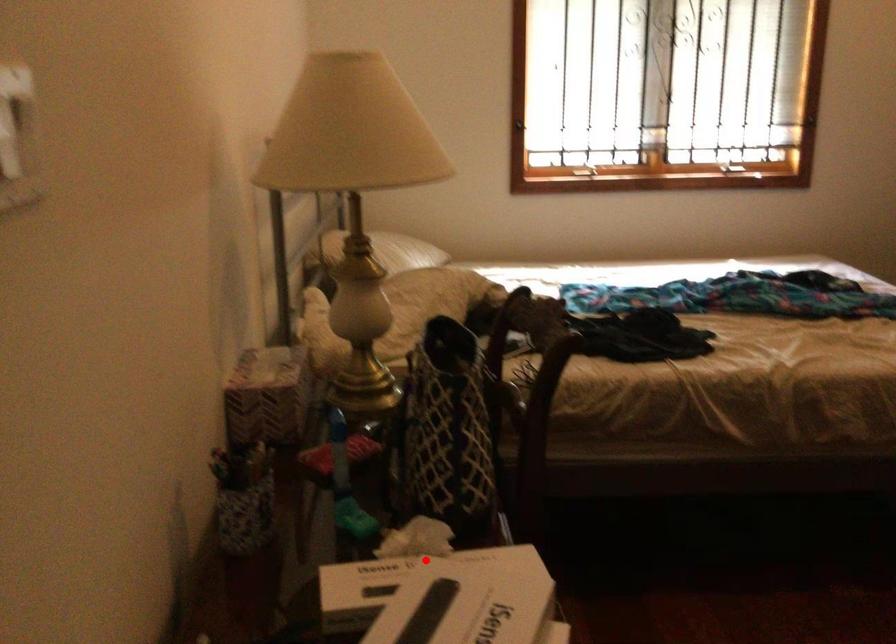
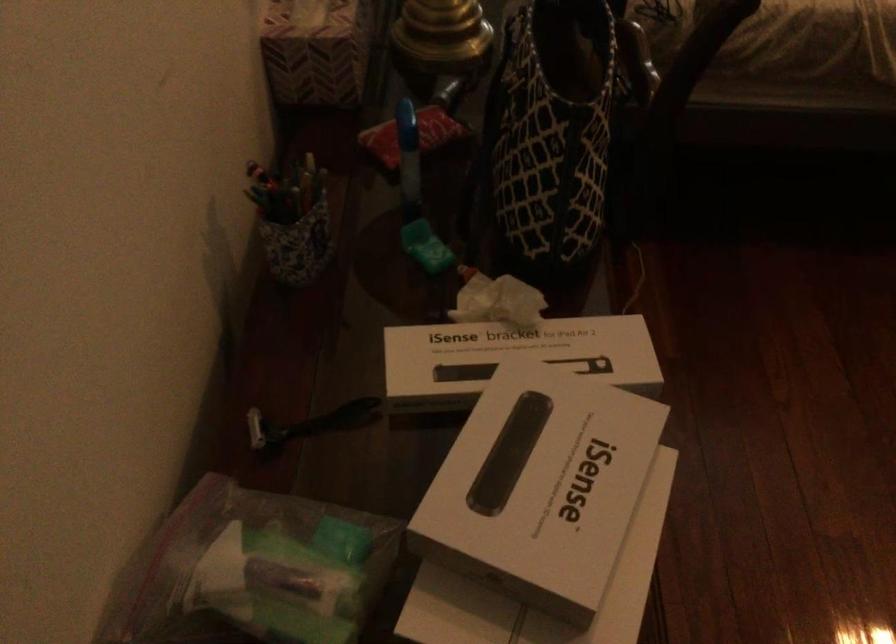
In the second image, find the point that corresponds to the highlighted location in the first image.

(515, 353)